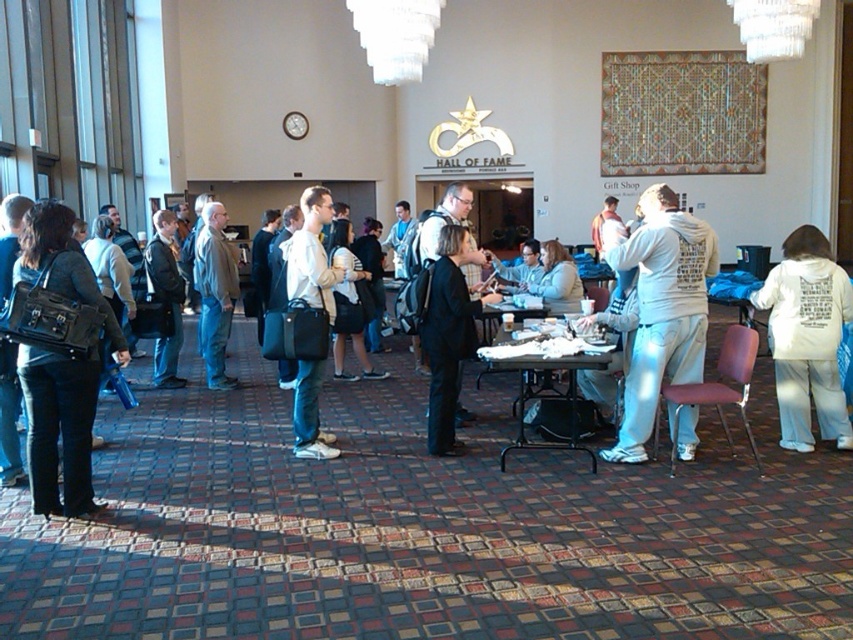
Who is positioned more to the left, white cotton hoodie at right or white matte jacket at center?

Positioned to the left is white matte jacket at center.

Does white cotton hoodie at right appear on the left side of white matte jacket at center?

No, white cotton hoodie at right is not to the left of white matte jacket at center.

Does point (764, 284) come closer to viewer compared to point (323, 284)?

No, it is behind (323, 284).

Image resolution: width=853 pixels, height=640 pixels. Find the location of `white cotton hoodie at right`. white cotton hoodie at right is located at coordinates (807, 339).

Who is positioned more to the right, white cotton hoodie at center or dark gray coat at left?

white cotton hoodie at center is more to the right.

Does white cotton hoodie at center appear over dark gray coat at left?

Actually, white cotton hoodie at center is below dark gray coat at left.

The height and width of the screenshot is (640, 853). I want to click on white cotton hoodie at center, so click(x=662, y=310).

Is matte black bag at left wider than dark gray coat at left?

Yes.

Based on the photo, is matte black bag at left above dark gray coat at left?

Incorrect, matte black bag at left is not positioned above dark gray coat at left.

Identify the location of matte black bag at left. Image resolution: width=853 pixels, height=640 pixels. (59, 426).